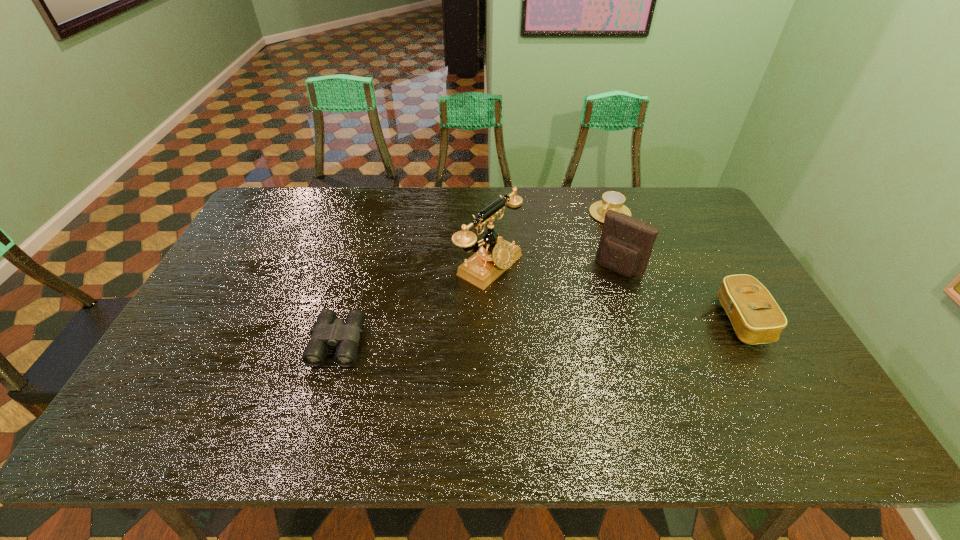
Find the location of a particular element. binoculars is located at coordinates point(328,331).

The height and width of the screenshot is (540, 960). I want to click on clutch bag, so (x=756, y=317).

Identify the location of the third shortest object. (756, 317).

At what (x,y) coordinates should I click in order to perform the action: click on pouch. Please return your answer as a coordinate pair (x, y). Looking at the image, I should click on (625, 246).

Identify the location of telephone. This screenshot has width=960, height=540. (496, 255).

Where is `the fourth object from right to left`? The image size is (960, 540). the fourth object from right to left is located at coordinates (496, 255).

Where is `the farthest object`? the farthest object is located at coordinates (611, 200).

What are the coordinates of `vacant space located 0.060m at the eyepiece of the leftmost object` in the screenshot? It's located at (322, 390).

This screenshot has height=540, width=960. Identify the location of vacant space situated 0.110m with an open flap on the pouch. (592, 300).

Where is `vacant region located 0.200m with an open flap on the pouch`? vacant region located 0.200m with an open flap on the pouch is located at coordinates (577, 319).